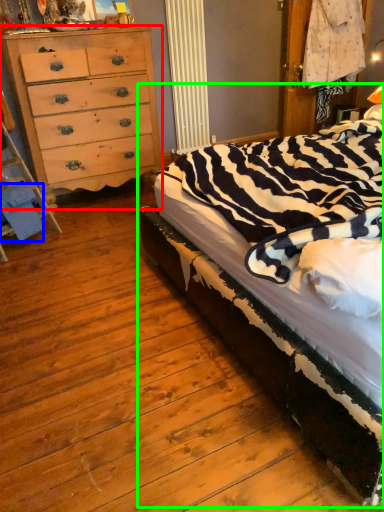
Question: Which is nearer to the chest of drawers (highlighted by a red box)? material (highlighted by a blue box) or bed (highlighted by a green box).

Choices:
 (A) material
 (B) bed

Answer: (A)